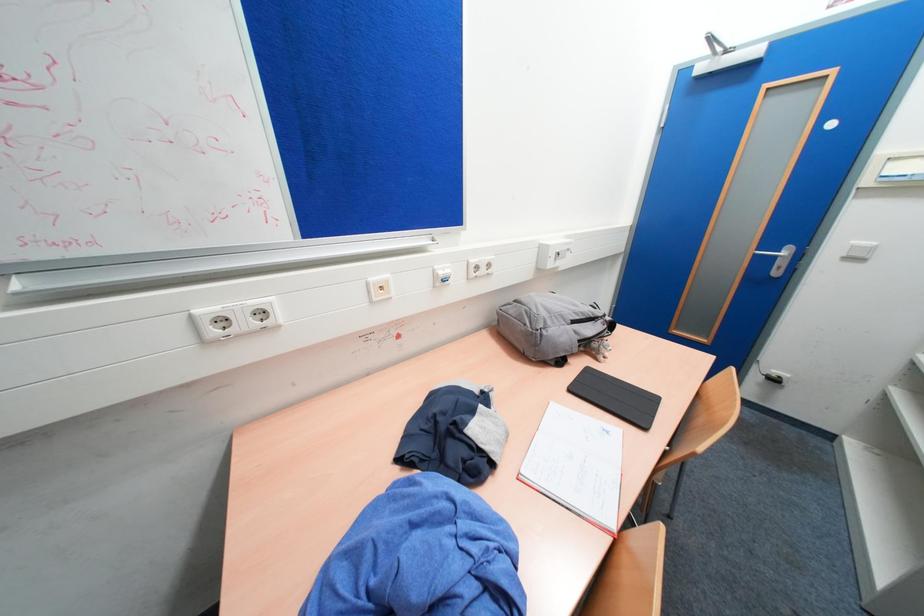
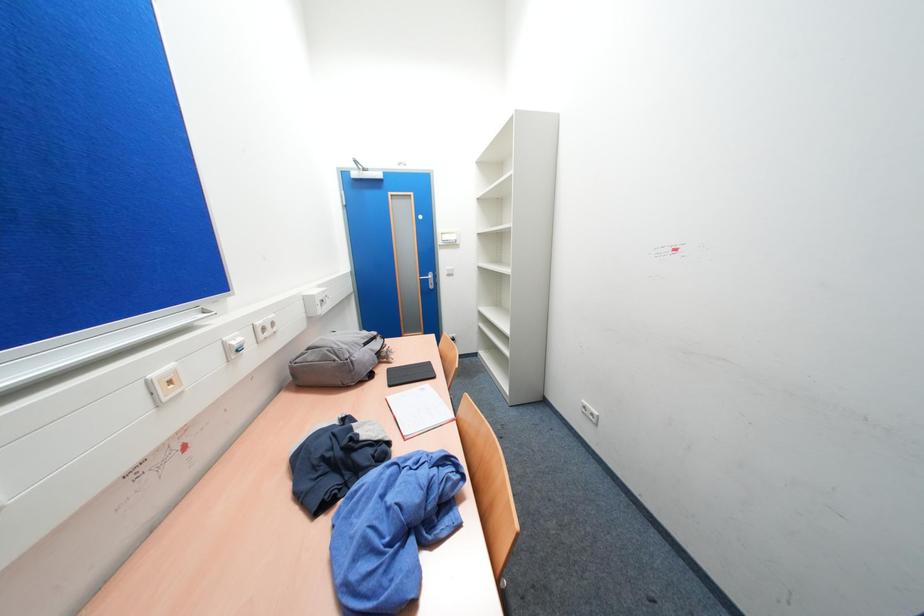
Question: The camera is either moving clockwise (left) or counter-clockwise (right) around the object. The first image is from the beginning of the video and the second image is from the end. Is the camera moving left or right when shooting the video?

Choices:
 (A) Left
 (B) Right

Answer: (A)